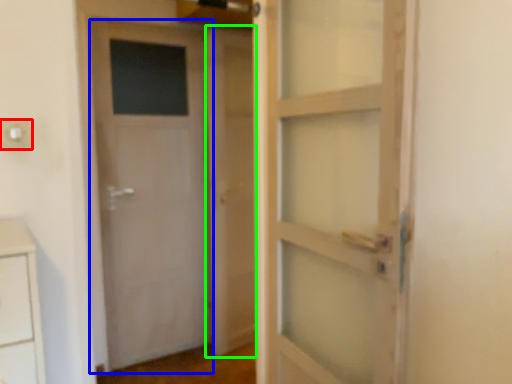
Question: Based on their relative distances, which object is nearer to electric outlet (highlighted by a red box)? Choose from door (highlighted by a blue box) and barn door (highlighted by a green box).

Choices:
 (A) door
 (B) barn door

Answer: (A)